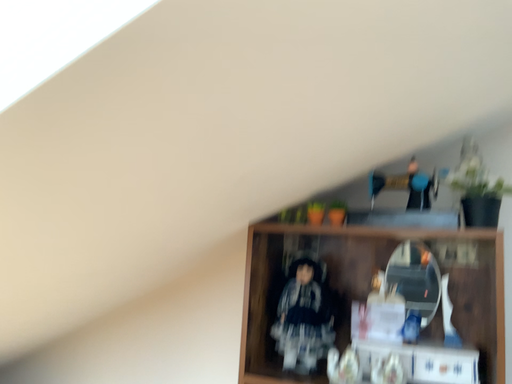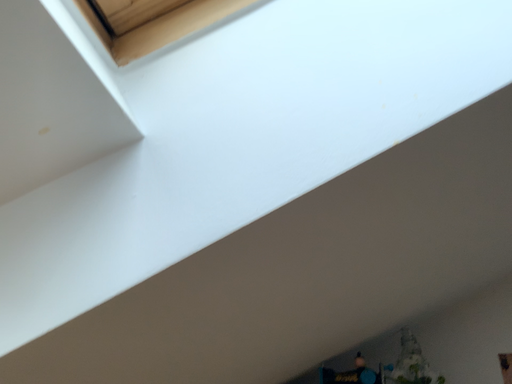
Question: Which way did the camera rotate in the video?

Choices:
 (A) rotated right
 (B) rotated left

Answer: (A)